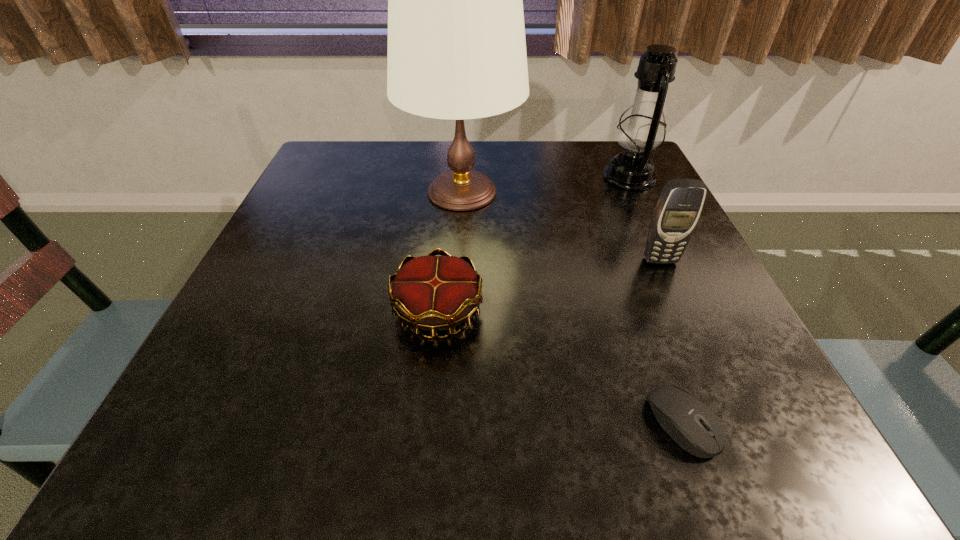
I want to click on the tallest object, so (456, 37).

At what (x,y) coordinates should I click in order to perform the action: click on oil lamp. Please return your answer as a coordinate pair (x, y). This screenshot has height=540, width=960. Looking at the image, I should click on (641, 130).

The width and height of the screenshot is (960, 540). I want to click on the third tallest object, so click(679, 206).

Image resolution: width=960 pixels, height=540 pixels. Find the location of `the third farthest object`. the third farthest object is located at coordinates (679, 206).

Locate an element on the screen. the fourth tallest object is located at coordinates (434, 293).

Find the location of a particular element. The height and width of the screenshot is (540, 960). the fourth farthest object is located at coordinates (434, 293).

At what (x,y) coordinates should I click in order to perform the action: click on the nearest object. Please return your answer as a coordinate pair (x, y). The height and width of the screenshot is (540, 960). Looking at the image, I should click on (688, 421).

At what (x,y) coordinates should I click in order to perform the action: click on computer equipment. Please return your answer as a coordinate pair (x, y). Image resolution: width=960 pixels, height=540 pixels. Looking at the image, I should click on (688, 421).

Find the location of a particular element. blank space located 0.340m on the front of the tallest object is located at coordinates (452, 366).

Where is `vacant space situated on the front of the fourth shortest object`? This screenshot has width=960, height=540. vacant space situated on the front of the fourth shortest object is located at coordinates (700, 326).